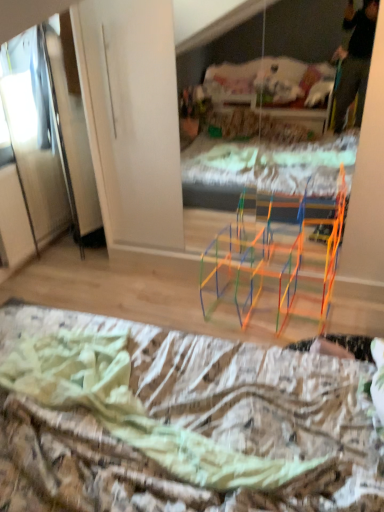
What do you see at coordinates (189, 424) in the screenshot? The height and width of the screenshot is (512, 384). I see `patterned fabric bed at center` at bounding box center [189, 424].

What is the approximate height of patterned fabric bed at center?

The height of patterned fabric bed at center is 13.72 centimeters.

You are a GUI agent. You are given a task and a screenshot of the screen. Output one action in this format:
    pyautogui.click(x=<x>, y=<y>)
    Task: Click on the patterned fabric bed at center
    This screenshot has height=512, width=384.
    Given the screenshot: What is the action you would take?
    point(189,424)

Identify the location of patterned fabric bed at center. (189, 424).